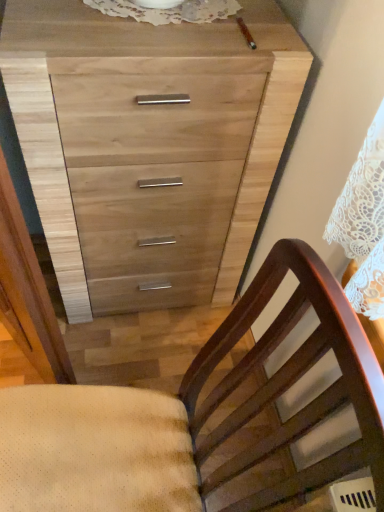
Identify the location of blank space above natural wood chest of drawers at upper center (from a real-world perspective). The height and width of the screenshot is (512, 384). 158,24.